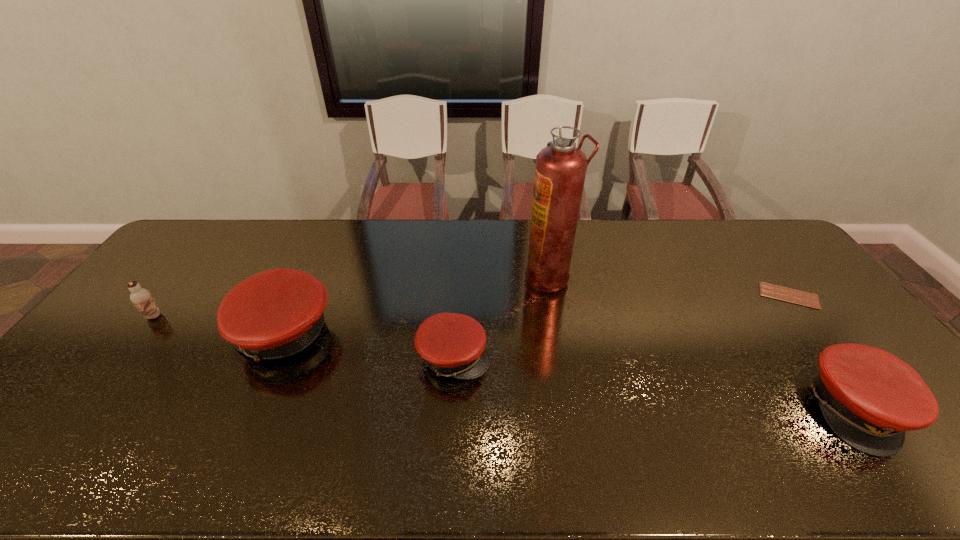
Locate an element on the screen. The width and height of the screenshot is (960, 540). location for an additional cap_(headwear) to make spacing equal is located at coordinates (644, 381).